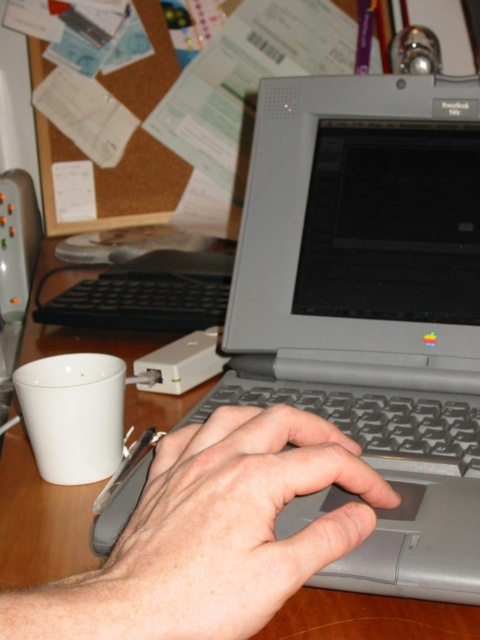
You are designing a new ergonomic desk setup and want to ensure there is enough space between the gray matte hand at center and the black plastic keyboard at center for comfortable use. Based on their sizes, which object should you consider placing further away to accommodate this requirement?

The gray matte hand at center occupies less space than the black plastic keyboard at center, so you should place the black plastic keyboard at center further away to create more space between them for comfortable use.

You are organizing the desk and need to place a new keyboard. The current gray plastic keyboard at center is in the way. Which object is blocking the path to the wooden table at center?

The gray plastic keyboard at center is blocking the path to the wooden table at center because it is positioned to the right of the wooden table at center.

You are a user trying to type on the black plastic keyboard at center. However, your hand is currently at the gray matte hand at center. Is your hand blocking the keyboard?

The gray matte hand at center is located below the black plastic keyboard at center, so the hand is not blocking the keyboard and typing should be possible.